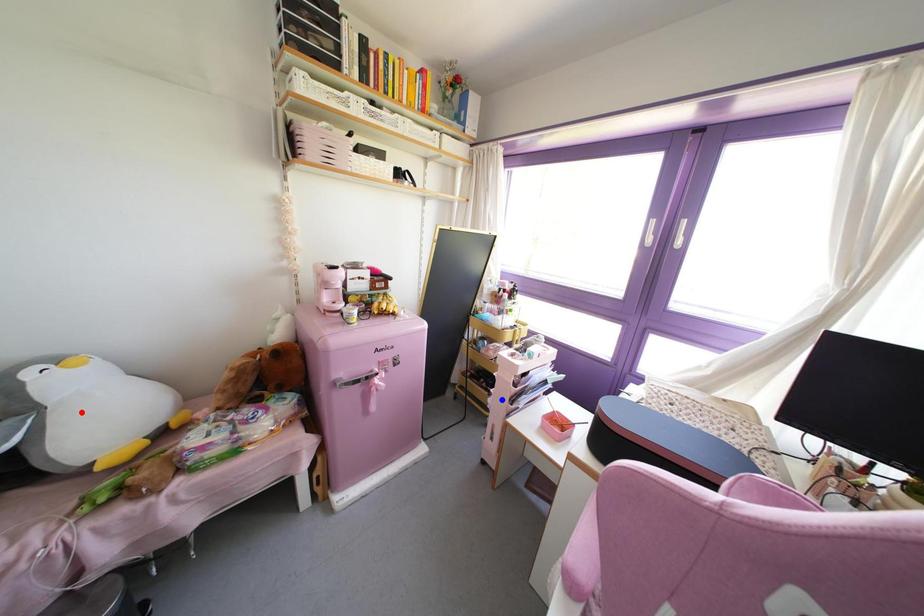
Question: Two points are marked on the image. Which point is closer to the camera?

Choices:
 (A) Blue point is closer.
 (B) Red point is closer.

Answer: (B)